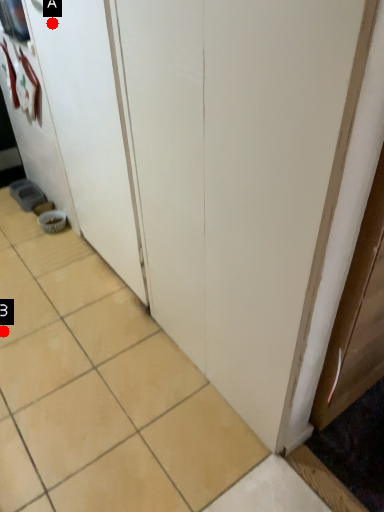
Question: Two points are circled on the image, labeled by A and B beside each circle. Which point appears closest to the camera in this image?

Choices:
 (A) A is closer
 (B) B is closer

Answer: (A)